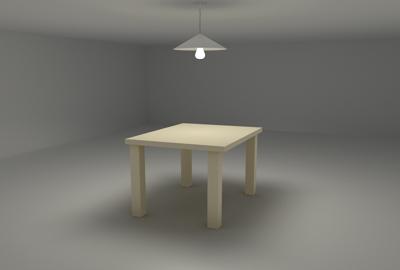
In order to click on lighting mount in this screenshot , I will do `click(203, 3)`.